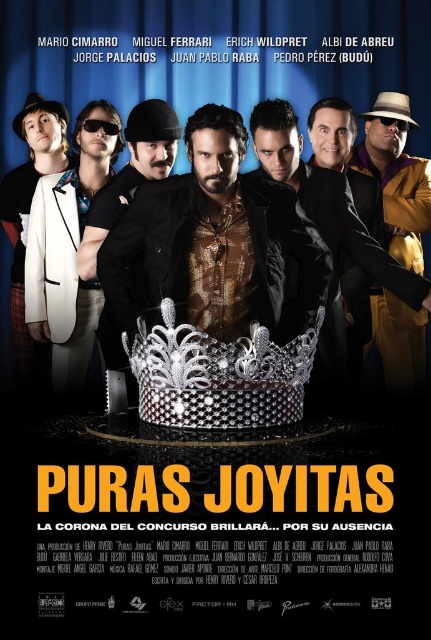
Based on the movie poster for Puras Joyitas, which object is shorter between the silver metallic crown at center and the sunglasses at left?

The silver metallic crown at center is shorter than the sunglasses at left.

Based on the movie poster for Puras Joyitas, where is the silver metallic crown at center positioned in terms of coordinates?

The silver metallic crown at center is positioned at coordinates point (218, 376).

You are a photographer adjusting your camera to focus on two points in the movie poster. The first point is at coordinates point (250, 326) and the second is at point (68, 387). Which point should you focus on first if you want to capture the closest object in the scene?

Point (250, 326) is closer to the camera than point (68, 387), so you should focus on point (250, 326) first to capture the closest object in the scene.